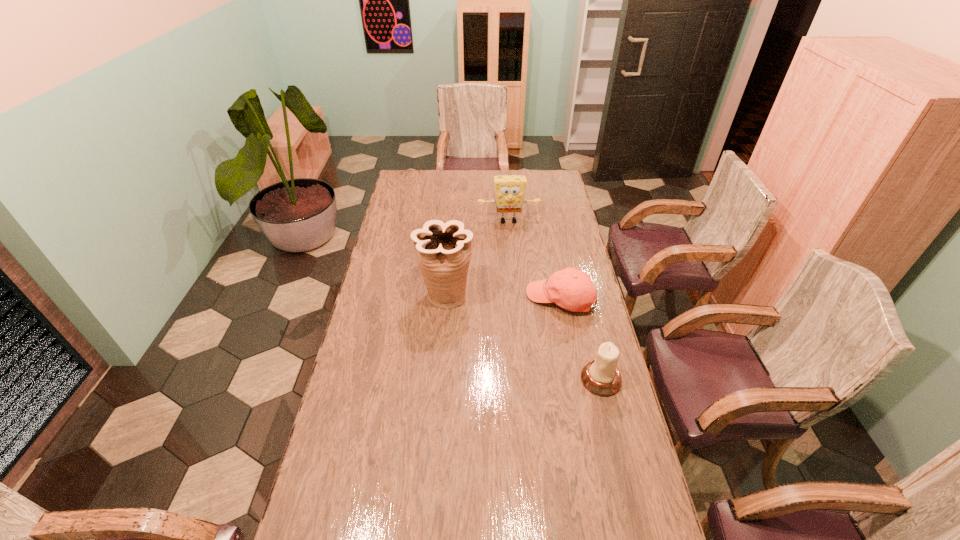
I want to click on the leftmost object, so click(x=443, y=250).

The width and height of the screenshot is (960, 540). I want to click on the tallest object, so click(x=443, y=250).

The height and width of the screenshot is (540, 960). In order to click on candle holder in this screenshot , I will do `click(601, 376)`.

I want to click on the nearest object, so click(601, 376).

In order to click on baseball cap in this screenshot , I will do `click(572, 289)`.

Locate an element on the screen. Image resolution: width=960 pixels, height=540 pixels. the farthest object is located at coordinates (509, 190).

The width and height of the screenshot is (960, 540). I want to click on sponge, so click(x=509, y=190).

At what (x,y) coordinates should I click in order to perform the action: click on blank space located on the back of the tallest object. Please return your answer as a coordinate pair (x, y). Looking at the image, I should click on (450, 241).

Find the location of a particular element. Image resolution: width=960 pixels, height=540 pixels. blank space located on the back of the second shortest object is located at coordinates (580, 293).

Identify the location of free location located on the front-facing side of the baseball cap. The width and height of the screenshot is (960, 540). tap(496, 330).